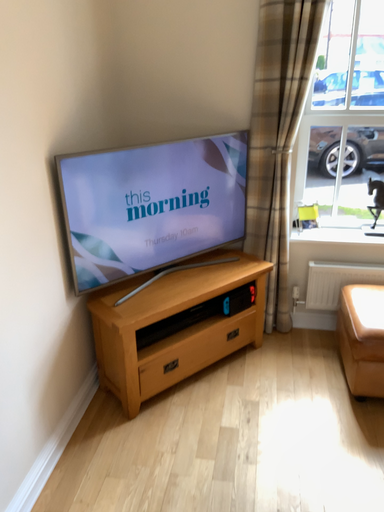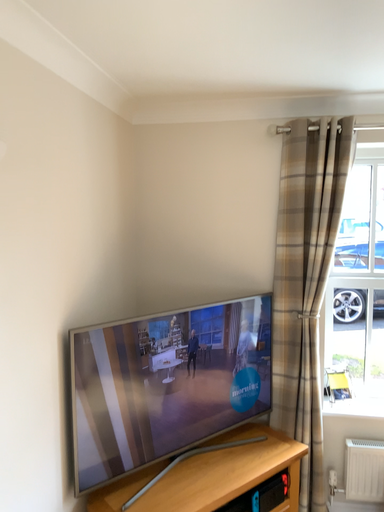
Question: How did the camera likely rotate when shooting the video?

Choices:
 (A) rotated downward
 (B) rotated upward

Answer: (B)